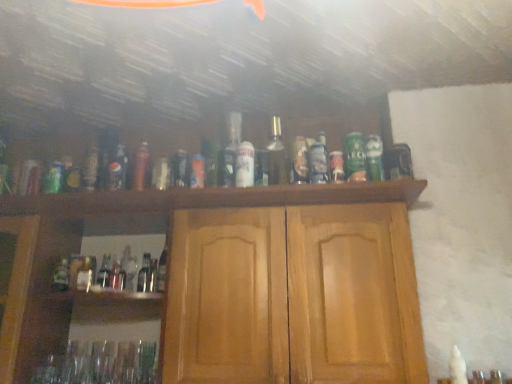
Locate an element on the screen. blank space to the left of matte glass bottle at center, marked as the 3th bottle in a right-to-left arrangement is located at coordinates tap(187, 208).